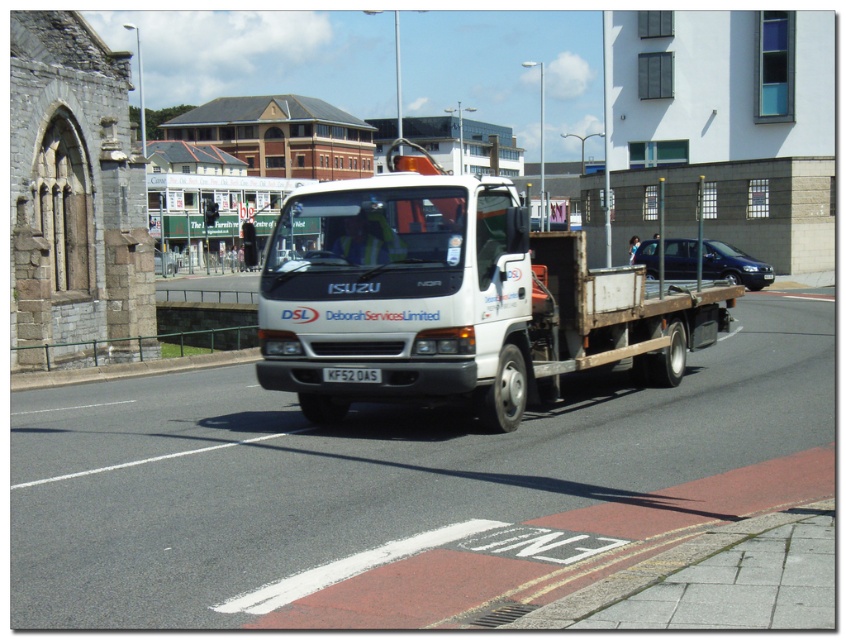
Who is lower down, white matte truck at center or white plastic license plate at center?

white plastic license plate at center is below.

Is white matte truck at center shorter than white plastic license plate at center?

Incorrect, white matte truck at center's height does not fall short of white plastic license plate at center's.

I want to click on white matte truck at center, so click(452, 298).

You are a GUI agent. You are given a task and a screenshot of the screen. Output one action in this format:
    pyautogui.click(x=<x>, y=<y>)
    Task: Click on the white matte truck at center
    
    Given the screenshot: What is the action you would take?
    pyautogui.click(x=452, y=298)

Is dark blue metallic van at center wider than white plastic license plate at center?

Indeed, dark blue metallic van at center has a greater width compared to white plastic license plate at center.

Can you confirm if dark blue metallic van at center is thinner than white plastic license plate at center?

No, dark blue metallic van at center is not thinner than white plastic license plate at center.

Find the location of `dark blue metallic van at center`. dark blue metallic van at center is located at coordinates [x=733, y=266].

This screenshot has width=846, height=640. Identify the location of dark blue metallic van at center. (733, 266).

This screenshot has width=846, height=640. What are the coordinates of `white matte truck at center` in the screenshot? It's located at (452, 298).

The image size is (846, 640). What do you see at coordinates (452, 298) in the screenshot?
I see `white matte truck at center` at bounding box center [452, 298].

Describe the element at coordinates (452, 298) in the screenshot. I see `white matte truck at center` at that location.

Locate an element on the screen. white matte truck at center is located at coordinates (452, 298).